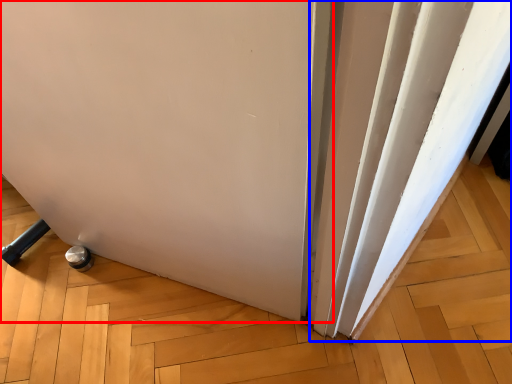
Question: Which of the following is the closest to the observer, door (highlighted by a red box) or curtain (highlighted by a blue box)?

Choices:
 (A) door
 (B) curtain

Answer: (A)